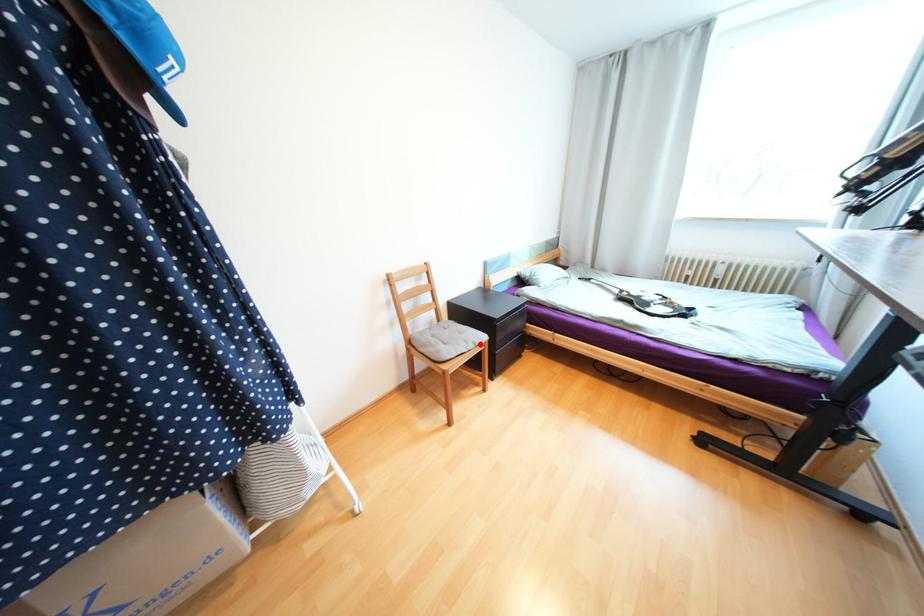
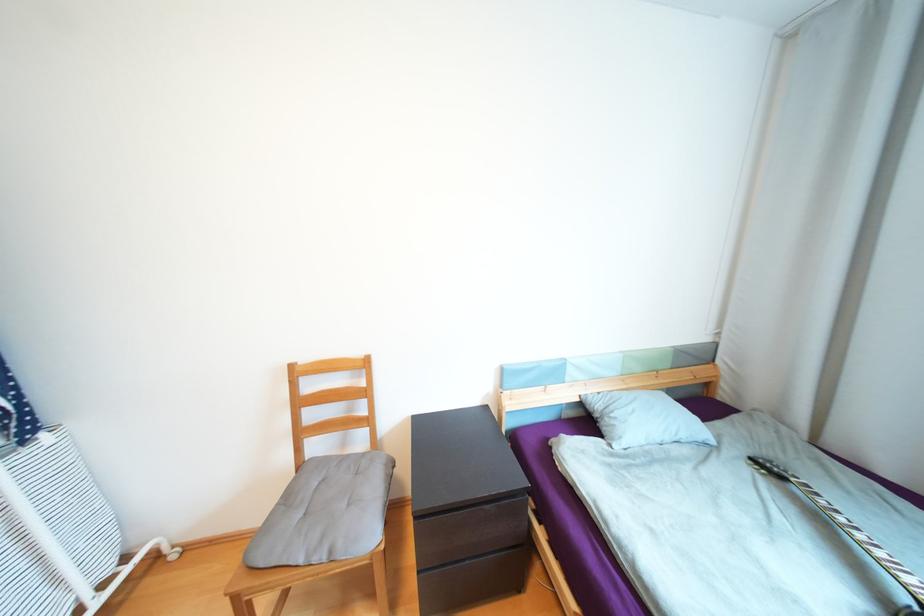
Question: I am providing you with two images of the same scene from different viewpoints. Given a red point in image1, look at the same physical point in image2. Is it:

Choices:
 (A) Closer to the viewpoint
 (B) Farther from the viewpoint

Answer: (B)